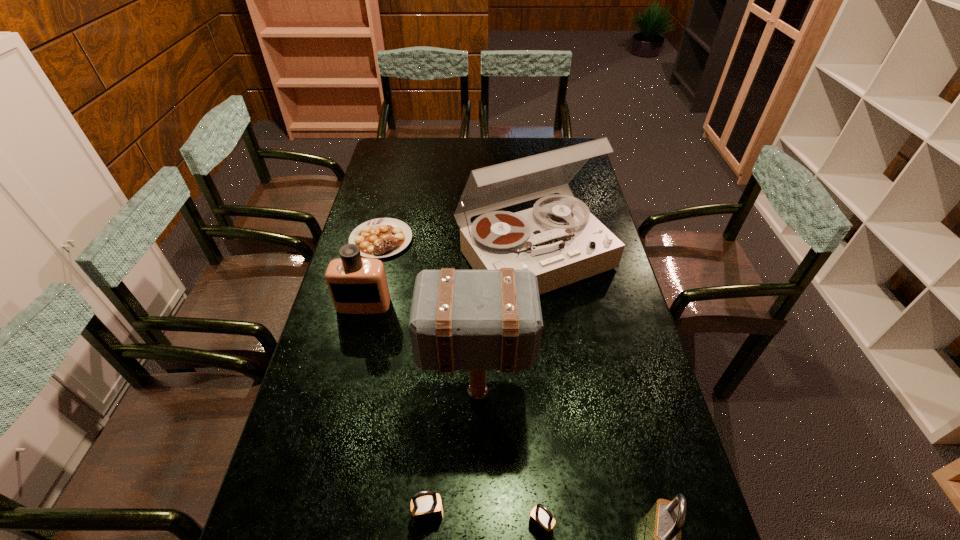
The image size is (960, 540). Find the location of `free space that satisfies the following two spatial constraints: 1. on the front side of the leftmost padlock; 2. on the left side of the shortest object`. free space that satisfies the following two spatial constraints: 1. on the front side of the leftmost padlock; 2. on the left side of the shortest object is located at coordinates (314, 515).

This screenshot has width=960, height=540. I want to click on blank area in the image that satisfies the following two spatial constraints: 1. on the back side of the second padlock from right to left; 2. on the right side of the record player, so click(517, 256).

The height and width of the screenshot is (540, 960). Identify the location of blank space that satisfies the following two spatial constraints: 1. on the front side of the shortest object; 2. on the right side of the record player. (377, 256).

Locate an element on the screen. The image size is (960, 540). free spot that satisfies the following two spatial constraints: 1. on the front side of the shortest object; 2. on the left side of the third shortest object is located at coordinates (314, 515).

You are a GUI agent. You are given a task and a screenshot of the screen. Output one action in this format:
    pyautogui.click(x=<x>, y=<y>)
    Task: Click on the vacant area in the image that satisfies the following two spatial constraints: 1. on the front label of the third shortest object; 2. on the left side of the fifth shortest object
    The image size is (960, 540).
    Given the screenshot: What is the action you would take?
    pyautogui.click(x=312, y=515)